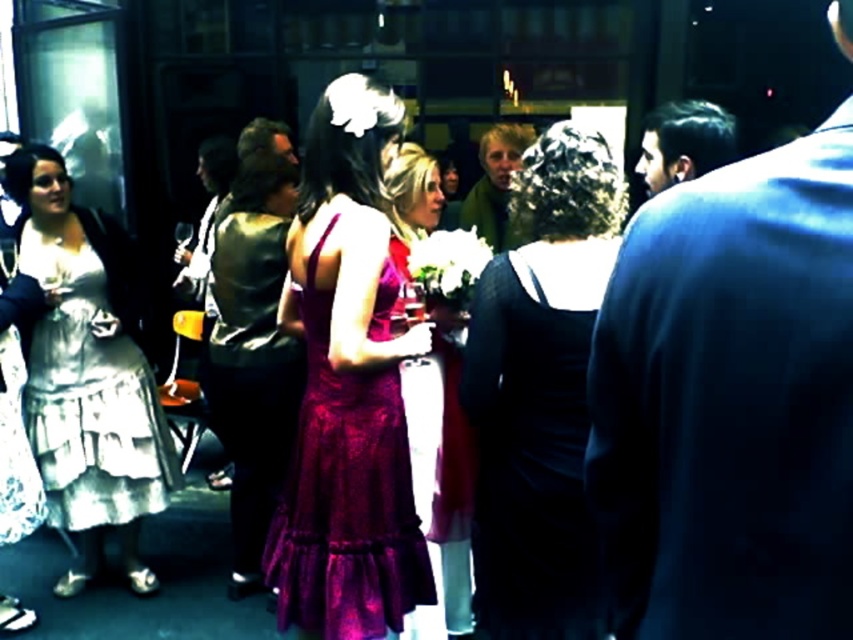
You are organizing a charity event and need to arrange seating based on the guests clothing. The dark blue suit at right and the green fuzzy sweater at center are both present. Which guest should be seated in a wider chair to accommodate their clothing?

The green fuzzy sweater at center requires a wider chair because its width is greater than the dark blue suit at right.

You are at the center of the image and want to move towards the dark blue suit at right. In which direction should you move?

You should move to the right to reach the dark blue suit at right since it is located at the right side of the image.